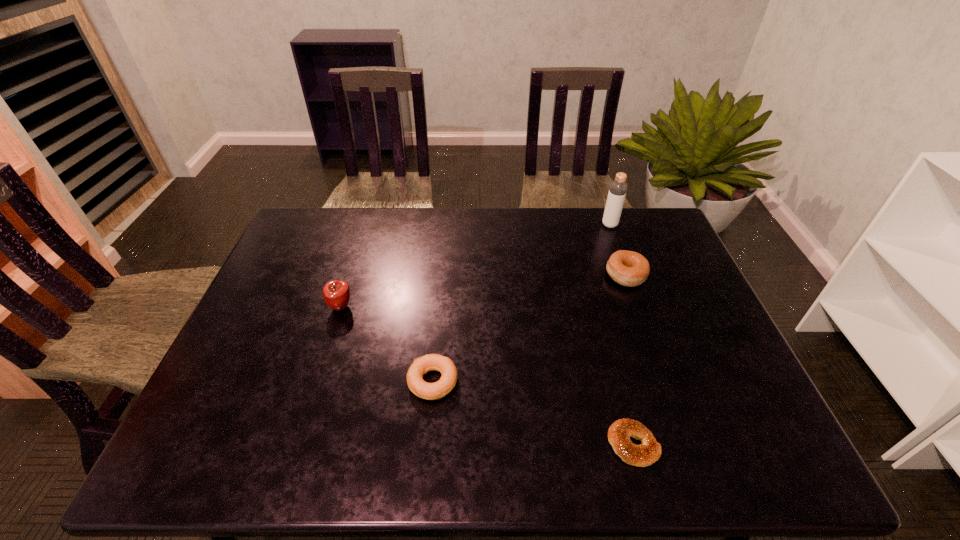
I want to click on free space at the far edge, so click(493, 245).

This screenshot has height=540, width=960. What are the coordinates of `vacant space at the near edge of the desktop` in the screenshot? It's located at (685, 470).

Locate an element on the screen. This screenshot has width=960, height=540. vacant space at the left edge is located at coordinates tap(289, 333).

Find the location of a particular element. vacant space at the right edge of the desktop is located at coordinates (702, 308).

Where is `free space at the near left corner`? free space at the near left corner is located at coordinates (209, 461).

In the image, there is a desktop. Identify the location of vacant space at the far right corner. (675, 250).

In order to click on vacant area between the shortest bagel and the third shortest object in this screenshot , I will do `click(630, 360)`.

The image size is (960, 540). In order to click on free space that is in between the third shortest object and the third nearest object in this screenshot , I will do `click(483, 291)`.

The image size is (960, 540). I want to click on vacant point located between the fourth shortest object and the nearest object, so click(x=487, y=376).

You are a GUI agent. You are given a task and a screenshot of the screen. Output one action in this format:
    pyautogui.click(x=<x>, y=<y>)
    Task: Click on the unoccupied position between the nearest bagel and the farthest bagel
    The height and width of the screenshot is (540, 960).
    Given the screenshot: What is the action you would take?
    pyautogui.click(x=630, y=360)